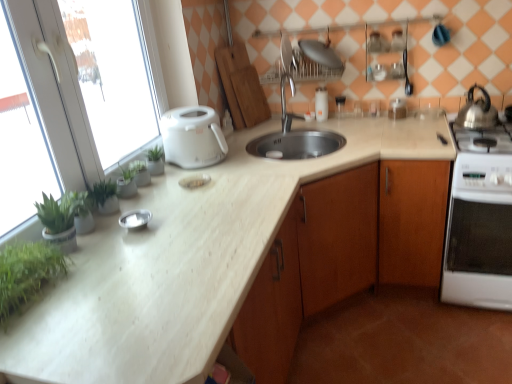
The width and height of the screenshot is (512, 384). I want to click on vacant point above white marble countertop at center (from a real-world perspective), so (x=249, y=187).